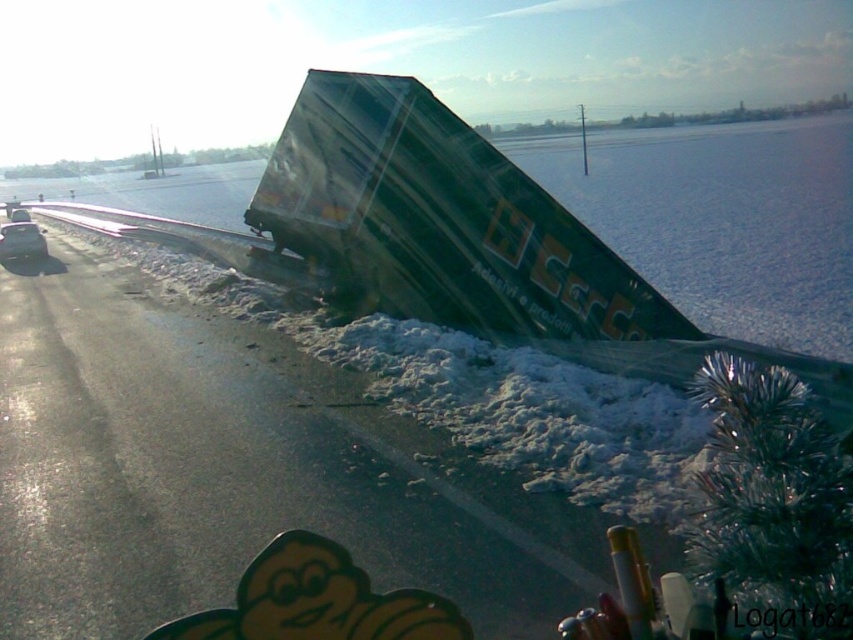
You are a traffic officer assessing the accident scene. You need to tow both the green glossy trailer truck at center and the metallic silver car at left. Which vehicle should you tow first if you have to prioritize the one that takes up more road space?

The metallic silver car at left should be towed first because it is larger in size compared to the green glossy trailer truck at center, meaning it occupies more road space.

You are a delivery driver who needs to transport a large package that requires a vehicle larger than the green glossy trailer truck at center. Looking at the image, can you determine if the green plastic truck at upper right is a suitable option?

The green plastic truck at upper right is bigger than the green glossy trailer truck at center, so it can carry the large package.